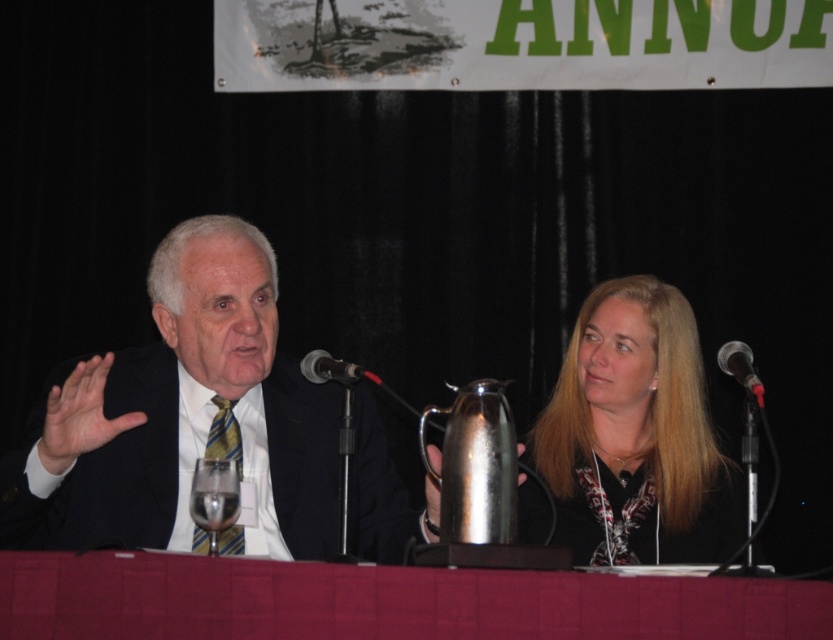
You are attending a formal event and need to place a small note between the two microphones on the table. The coordinates of the microphones are point (552, 620) and point (213, 554). Based on their positions, which microphone is closer to the front of the table? Please specify the coordinates of the microphone that is in front.

Point (552, 620) is in front of point (213, 554), so the microphone at coordinates point (552, 620) is closer to the front of the table.

You are standing in front of the table where the man and woman are seated. There is a point at coordinates point (187, 600) that you need to reach. Can you determine if you can comfortably reach that point without moving the table or any objects on it?

The point at (187, 600) is 1.54 meters away from you, so it may be difficult to reach comfortably without moving the table or objects since the distance is relatively far.